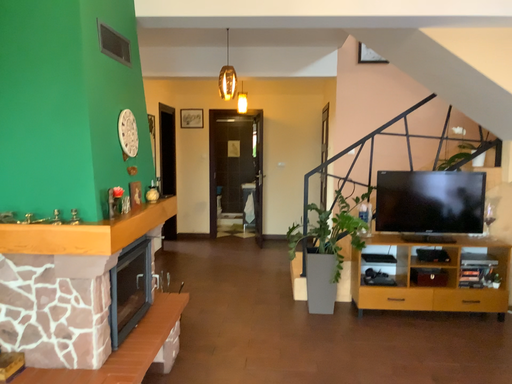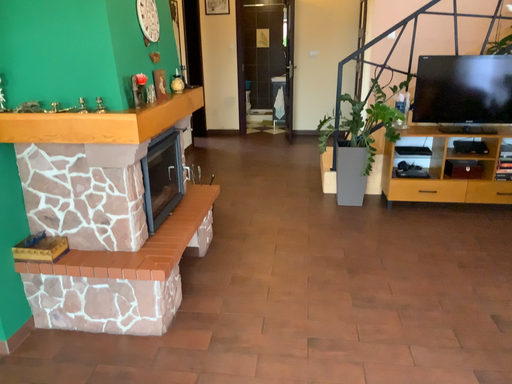
Question: How did the camera likely rotate when shooting the video?

Choices:
 (A) rotated upward
 (B) rotated downward

Answer: (B)